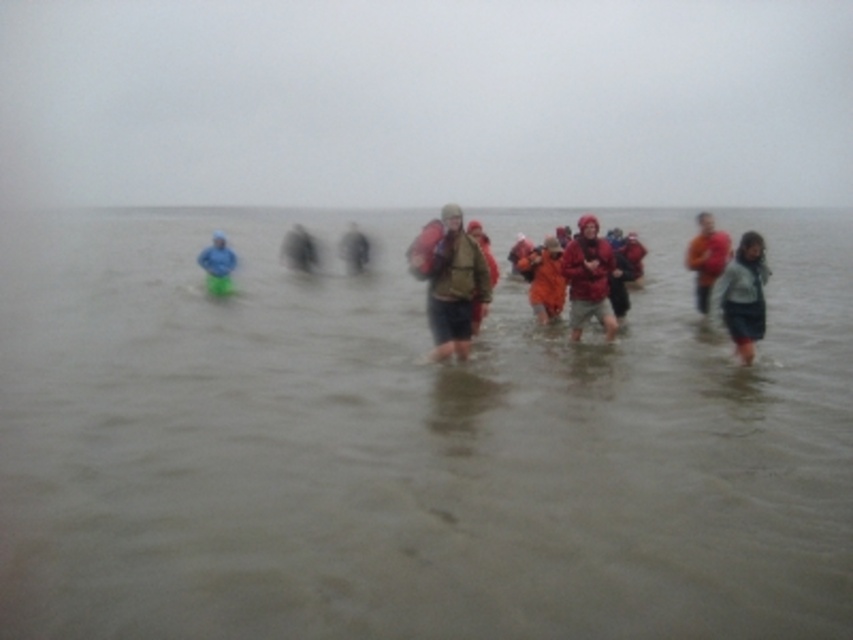
You are planning to pack your belongings into a storage container. You have the red fabric backpack at right and the blue matte jacket at left. Given their sizes, which item should you place first into the container to maximize space efficiency?

The red fabric backpack at right is bigger than the blue matte jacket at left, so you should place the red fabric backpack at right first to maximize space efficiency by putting larger items in first.

You are a hiker trying to decide whether to place your red fabric backpack at right on the ground next to the blue matte jacket at left. Considering their widths, will the backpack fit without overlapping the jacket?

The red fabric backpack at right might be wider than blue matte jacket at left, so there is a possibility it could overlap if placed next to it. Check the width before placing.

You are planning to take a photo of the scene. You want to ensure both the red matte jacket at center and the matte black backpack at center are clearly visible. Which object should you focus on first to capture both in the frame?

The red matte jacket at center occupies less space than the matte black backpack at center. To ensure both are clearly visible, focus on the matte black backpack at center first since it is larger and will be easier to frame, allowing the smaller red matte jacket at center to fit into the composition.